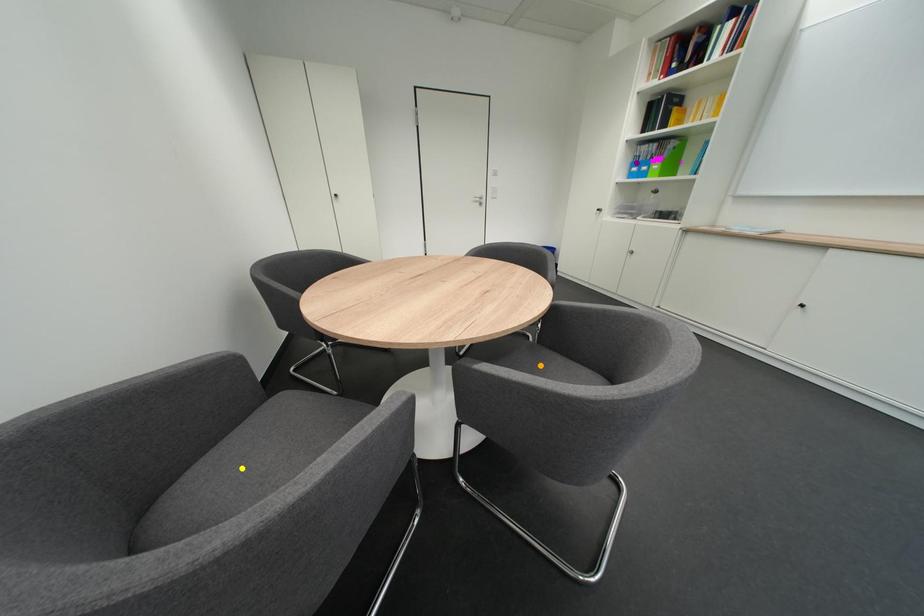
Order these from farthest to nearest:
orange point | purple point | yellow point

1. purple point
2. orange point
3. yellow point